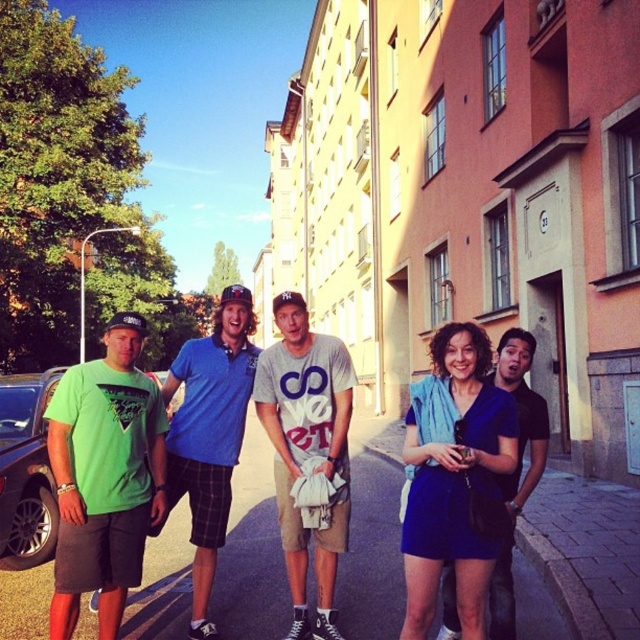
Which is below, green matte t-shirt at left or matte green car at left?

Positioned lower is matte green car at left.

Locate an element on the screen. The width and height of the screenshot is (640, 640). green matte t-shirt at left is located at coordinates (104, 476).

This screenshot has width=640, height=640. In order to click on matte asphalt pavement at center in this screenshot , I will do `click(252, 552)`.

What do you see at coordinates (252, 552) in the screenshot?
I see `matte asphalt pavement at center` at bounding box center [252, 552].

Between point (515, 582) and point (250, 348), which one is positioned in front?

Positioned in front is point (250, 348).

Find the location of a particular element. This screenshot has height=640, width=640. matte asphalt pavement at center is located at coordinates (252, 552).

Is point (68, 561) positioned after point (513, 353)?

That is False.

Who is shorter, green matte t-shirt at left or matte blue t-shirt at center?

Standing shorter between the two is green matte t-shirt at left.

Identify the location of green matte t-shirt at left. (x=104, y=476).